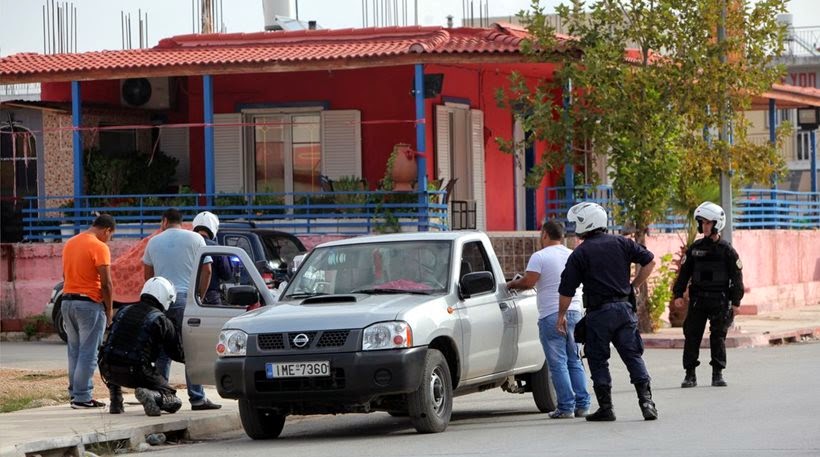
Locate an element on the screen. Image resolution: width=820 pixels, height=457 pixels. white shutters is located at coordinates (344, 143), (222, 168), (477, 151), (435, 158).